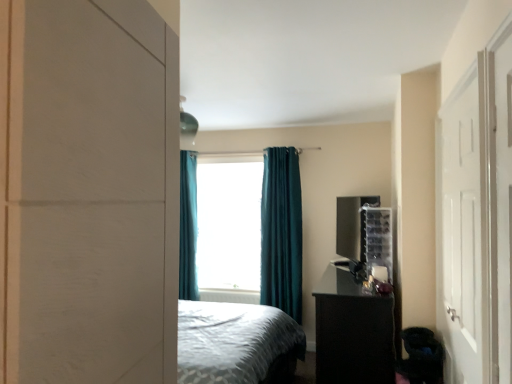
Question: Can you confirm if white plastic radiator at center is thinner than white matte door at right?

Choices:
 (A) yes
 (B) no

Answer: (B)

Question: Could you tell me if white plastic radiator at center is turned towards white matte door at right?

Choices:
 (A) yes
 (B) no

Answer: (B)

Question: Is white plastic radiator at center not near white matte door at right?

Choices:
 (A) no
 (B) yes

Answer: (B)

Question: Is white plastic radiator at center closer to the viewer compared to white matte door at right?

Choices:
 (A) yes
 (B) no

Answer: (B)

Question: Is white plastic radiator at center smaller than white matte door at right?

Choices:
 (A) yes
 (B) no

Answer: (A)

Question: From the image's perspective, would you say white plastic radiator at center is shown under white matte door at right?

Choices:
 (A) no
 (B) yes

Answer: (B)

Question: Is teal fabric curtain at center, arranged as the 2th curtain when viewed from the left, looking in the opposite direction of teal fabric curtain at left, the 1th curtain viewed from the back?

Choices:
 (A) yes
 (B) no

Answer: (B)

Question: Can you confirm if teal fabric curtain at center, the second curtain when ordered from back to front, is positioned to the left of teal fabric curtain at left, which ranks as the first curtain in left-to-right order?

Choices:
 (A) no
 (B) yes

Answer: (A)

Question: Is teal fabric curtain at center, which is the 1th curtain in right-to-left order, aimed at teal fabric curtain at left, positioned as the second curtain in right-to-left order?

Choices:
 (A) no
 (B) yes

Answer: (A)

Question: From the image's perspective, is teal fabric curtain at center, placed as the first curtain when sorted from front to back, below teal fabric curtain at left, the 1th curtain viewed from the back?

Choices:
 (A) no
 (B) yes

Answer: (B)

Question: Does teal fabric curtain at center, the second curtain when ordered from back to front, have a greater height compared to teal fabric curtain at left, positioned as the second curtain in right-to-left order?

Choices:
 (A) no
 (B) yes

Answer: (B)

Question: Is teal fabric curtain at center, placed as the first curtain when sorted from front to back, positioned beyond the bounds of teal fabric curtain at left, the 1th curtain viewed from the back?

Choices:
 (A) yes
 (B) no

Answer: (A)

Question: Considering the relative sizes of teal curtain at center and white matte door at right in the image provided, is teal curtain at center bigger than white matte door at right?

Choices:
 (A) no
 (B) yes

Answer: (B)